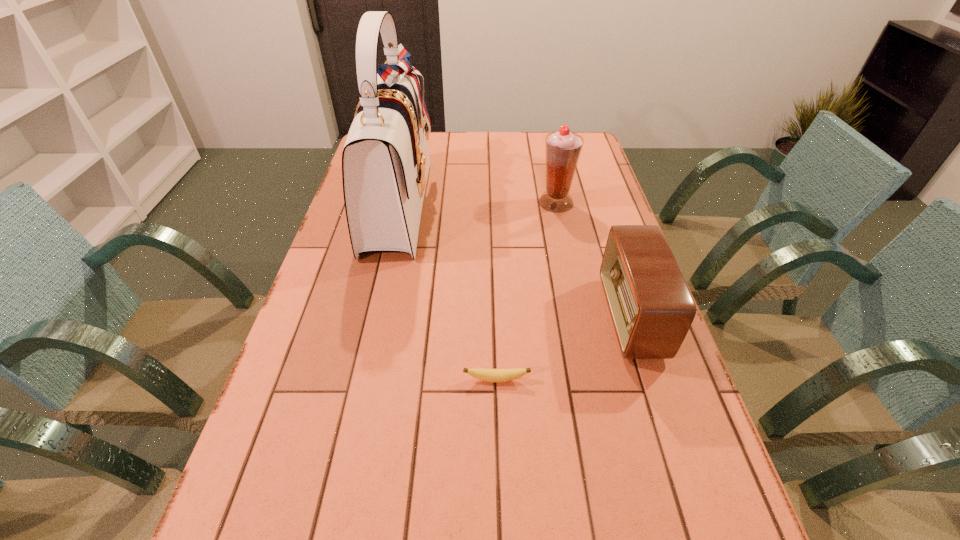
Identify the location of vacant space located on the front-facing side of the rightmost object. The width and height of the screenshot is (960, 540). (479, 318).

The height and width of the screenshot is (540, 960). In order to click on vacant space located 0.300m on the front-facing side of the rightmost object in this screenshot , I will do `click(487, 318)`.

Locate an element on the screen. The image size is (960, 540). free space located on the front-facing side of the rightmost object is located at coordinates (588, 318).

Where is `free space located on the back of the nearest object`? free space located on the back of the nearest object is located at coordinates (494, 299).

Where is `object that is at the far edge`? Image resolution: width=960 pixels, height=540 pixels. object that is at the far edge is located at coordinates (385, 161).

At what (x,y) coordinates should I click in order to perform the action: click on object that is at the left edge. Please return your answer as a coordinate pair (x, y). Looking at the image, I should click on (385, 161).

This screenshot has height=540, width=960. I want to click on smoothie that is at the right edge, so click(563, 148).

The height and width of the screenshot is (540, 960). Identify the location of radio receiver situated at the right edge. (652, 309).

Where is `object that is positioned at the far left corner`? The height and width of the screenshot is (540, 960). object that is positioned at the far left corner is located at coordinates (385, 161).

Locate an element on the screen. The image size is (960, 540). blank space at the far edge is located at coordinates (472, 147).